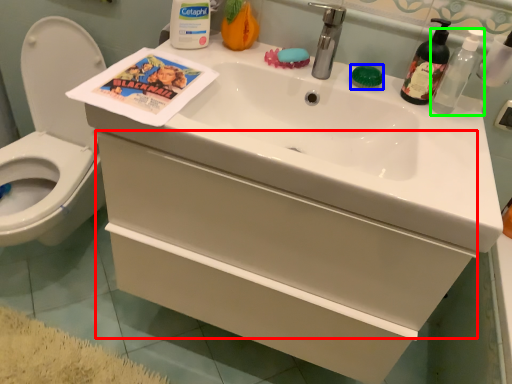
Question: Based on their relative distances, which object is nearer to drawer (highlighted by a red box)? Choose from soap (highlighted by a blue box) and bottle (highlighted by a green box).

Choices:
 (A) soap
 (B) bottle

Answer: (A)